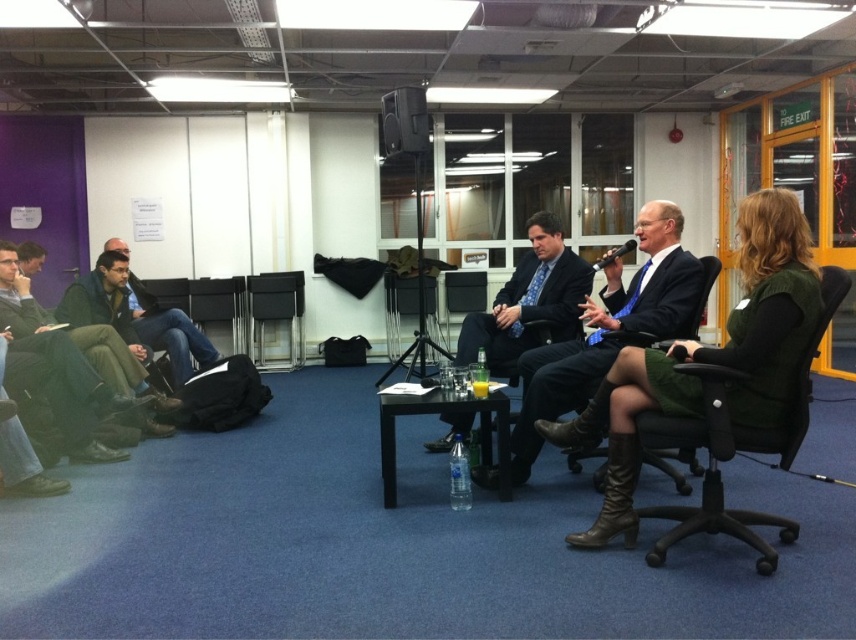
Question: Which point is farther to the camera?

Choices:
 (A) (805, 387)
 (B) (700, 310)
 (C) (235, 323)

Answer: (C)

Question: Can you confirm if blue suit at center is bigger than dark green fabric chair at center?

Choices:
 (A) yes
 (B) no

Answer: (A)

Question: Which object appears farthest from the camera in this image?

Choices:
 (A) black leather chair at center
 (B) matte black speaker at upper center
 (C) dark green jacket at left
 (D) dark green fabric chair at center

Answer: (A)

Question: Does green fabric skirt at center have a lesser width compared to blue suit at center?

Choices:
 (A) no
 (B) yes

Answer: (B)

Question: Among these objects, which one is farthest from the camera?

Choices:
 (A) matte black speaker at upper center
 (B) dark green jacket at left

Answer: (A)

Question: In this image, where is blue suit at center located relative to dark green fabric chair at center?

Choices:
 (A) above
 (B) below

Answer: (A)